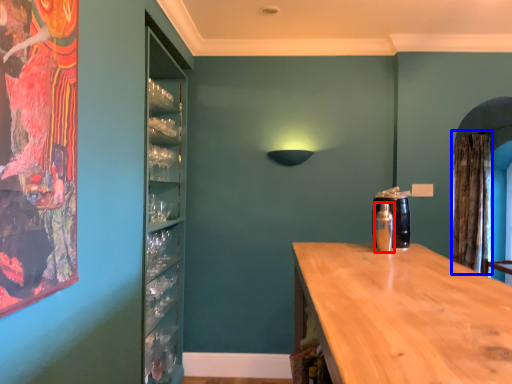
Question: Which point is closer to the camera, bottle (highlighted by a red box) or curtain (highlighted by a blue box)?

Choices:
 (A) bottle
 (B) curtain

Answer: (A)